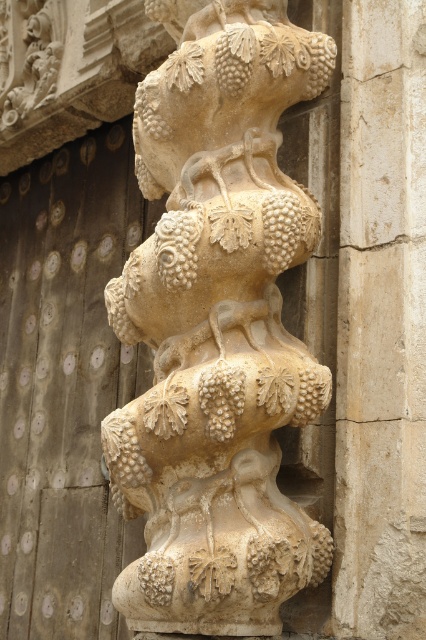
You are an architect inspecting the sculpture. You need to determine if the beige stone grapes at center can fit into a space designed for the beige stone column at center. Can they fit based on their widths?

The beige stone grapes at center are wider than the beige stone column at center, so they cannot fit into the space designed for the beige stone column at center.

You are an architect designing a new sculpture garden and want to place a bench exactly at the center of the beige stone grapes at center. What coordinates should you use for the bench placement?

The beige stone grapes at center are located at coordinates point (218, 326), so the bench should be placed at those coordinates.